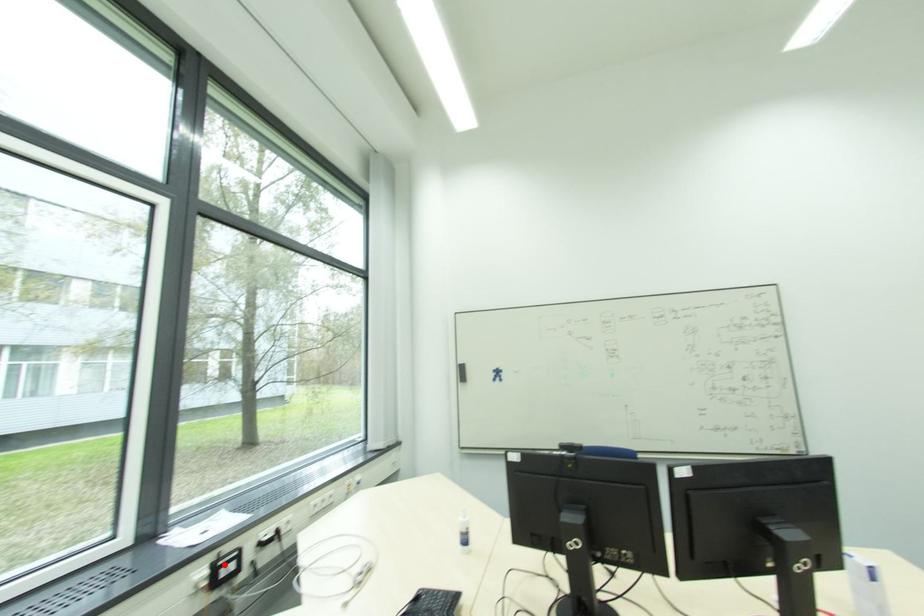
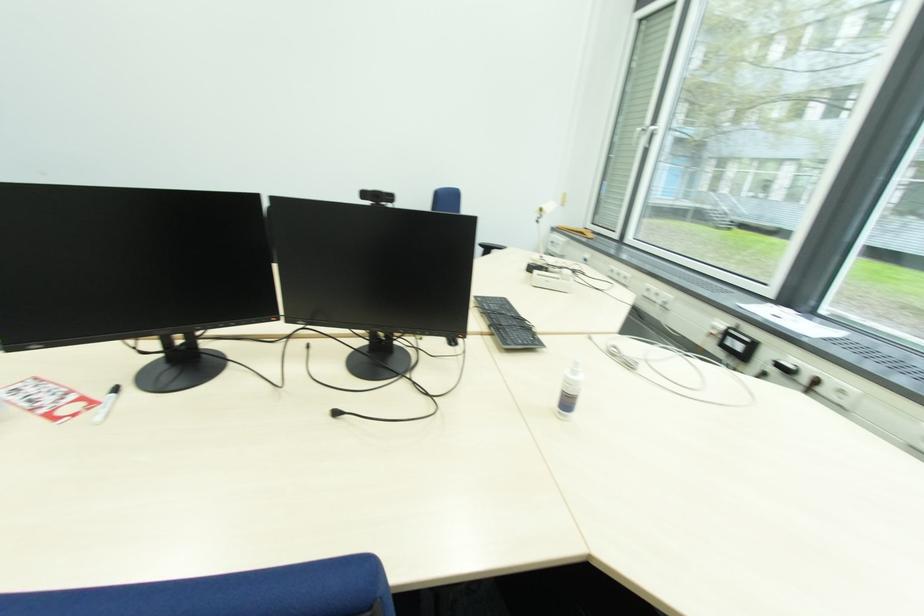
In the second image, find the point that corresponds to the highlighted location in the first image.

(734, 333)